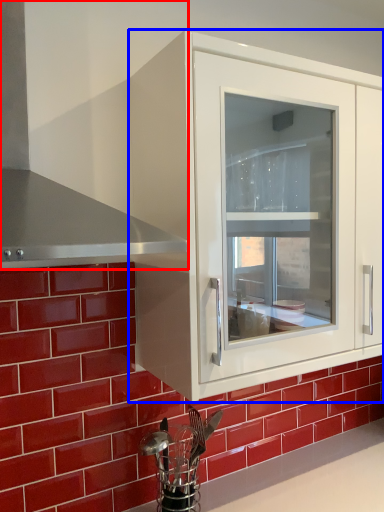
Question: Which object is closer to the camera taking this photo, exhaust hood (highlighted by a red box) or cabinetry (highlighted by a blue box)?

Choices:
 (A) exhaust hood
 (B) cabinetry

Answer: (A)